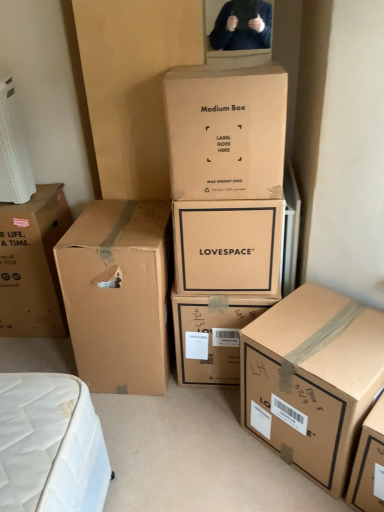
Question: From a real-world perspective, is matte cardboard box at center, the 4th box viewed from the left, physically below brown cardboard box at lower right, the 6th box from the left?

Choices:
 (A) yes
 (B) no

Answer: (B)

Question: Would you say matte cardboard box at center, the 4th box viewed from the left, is outside brown cardboard box at lower right, the 6th box from the left?

Choices:
 (A) yes
 (B) no

Answer: (A)

Question: Does matte cardboard box at center, the 4th box viewed from the left, have a lesser width compared to brown cardboard box at lower right, the 6th box from the left?

Choices:
 (A) no
 (B) yes

Answer: (B)

Question: Is matte cardboard box at center, positioned as the third box in right-to-left order, far away from brown cardboard box at lower right, the 1th box from the right?

Choices:
 (A) no
 (B) yes

Answer: (A)

Question: From a real-world perspective, is matte cardboard box at center, positioned as the third box in right-to-left order, on top of brown cardboard box at lower right, the 6th box from the left?

Choices:
 (A) no
 (B) yes

Answer: (B)

Question: Based on their positions, is matte brown box at center, which is the 5th box in left-to-right order, located to the left or right of matte cardboard box at center, the 4th box viewed from the left?

Choices:
 (A) left
 (B) right

Answer: (B)

Question: In terms of width, does matte brown box at center, the second box positioned from the right, look wider or thinner when compared to matte cardboard box at center, the 4th box viewed from the left?

Choices:
 (A) thin
 (B) wide

Answer: (B)

Question: In the image, is matte brown box at center, which is the 5th box in left-to-right order, positioned in front of or behind matte cardboard box at center, positioned as the third box in right-to-left order?

Choices:
 (A) behind
 (B) front

Answer: (A)

Question: Is matte brown box at center, which is the 5th box in left-to-right order, bigger or smaller than matte cardboard box at center, the 4th box viewed from the left?

Choices:
 (A) small
 (B) big

Answer: (B)

Question: From a real-world perspective, is brown cardboard box at lower right, the 1th box from the right, physically located above or below matte brown box at center, the second box positioned from the right?

Choices:
 (A) below
 (B) above

Answer: (B)

Question: In the image, is brown cardboard box at lower right, the 1th box from the right, on the left side or the right side of matte brown box at center, which is the 5th box in left-to-right order?

Choices:
 (A) right
 (B) left

Answer: (A)

Question: Relative to matte brown box at center, which is the 5th box in left-to-right order, is brown cardboard box at lower right, the 6th box from the left, in front or behind?

Choices:
 (A) behind
 (B) front

Answer: (B)

Question: Looking at the image, does brown cardboard box at lower right, the 6th box from the left, seem bigger or smaller compared to matte brown box at center, which is the 5th box in left-to-right order?

Choices:
 (A) big
 (B) small

Answer: (B)

Question: In terms of size, does brown cardboard box at left, arranged as the 2th box when viewed from the left, appear bigger or smaller than brown cardboard box at left, the sixth box viewed from the right?

Choices:
 (A) big
 (B) small

Answer: (A)

Question: From the image's perspective, is brown cardboard box at left, arranged as the fifth box when viewed from the right, located above or below brown cardboard box at left, which is the first box from left to right?

Choices:
 (A) above
 (B) below

Answer: (B)